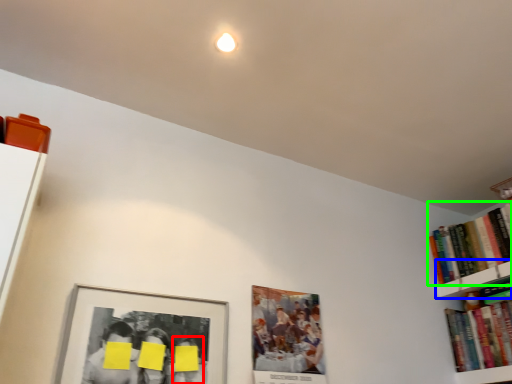
Question: Estimate the real-world distances between objects in this image. Which object is closer to person (highlighted by a red box), shelf (highlighted by a blue box) or book (highlighted by a green box)?

Choices:
 (A) shelf
 (B) book

Answer: (A)